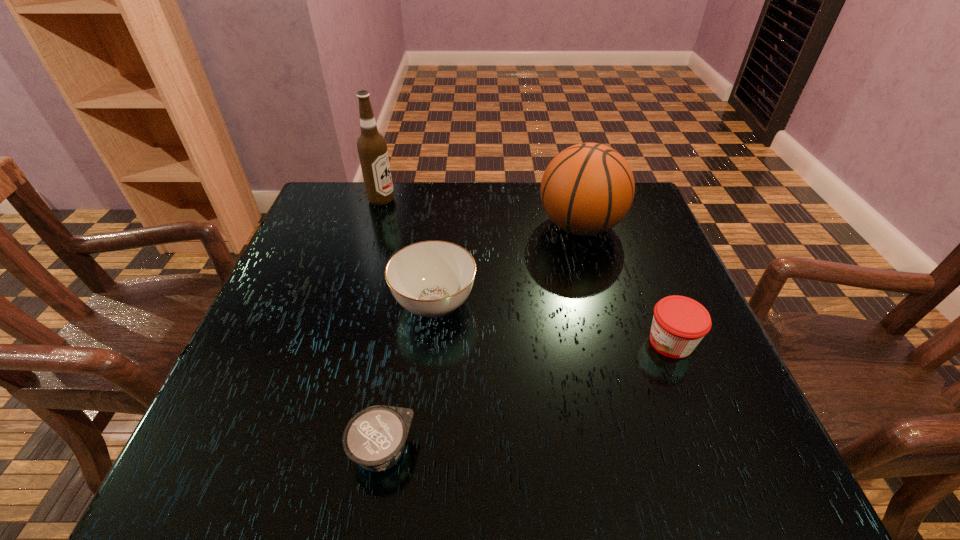
I want to click on vacant space situated 0.160m on the label side of the jam, so click(x=562, y=342).

Identify the location of free space located on the label side of the jam. (552, 342).

In order to click on vacant space located 0.380m on the label side of the jam in this screenshot , I will do `click(448, 342)`.

Locate an element on the screen. free space located 0.230m on the left of the nearest object is located at coordinates (204, 451).

Locate an element on the screen. The height and width of the screenshot is (540, 960). alcohol positioned at the far edge is located at coordinates (372, 148).

Find the location of a particular element. basketball that is at the far edge is located at coordinates (587, 189).

This screenshot has width=960, height=540. What are the coordinates of `object located in the near edge section of the desktop` in the screenshot? It's located at (374, 438).

This screenshot has width=960, height=540. What are the coordinates of `object present at the left edge` in the screenshot? It's located at (372, 148).

Identify the location of basketball located in the right edge section of the desktop. (587, 189).

Locate an element on the screen. This screenshot has height=540, width=960. jam at the right edge is located at coordinates (679, 323).